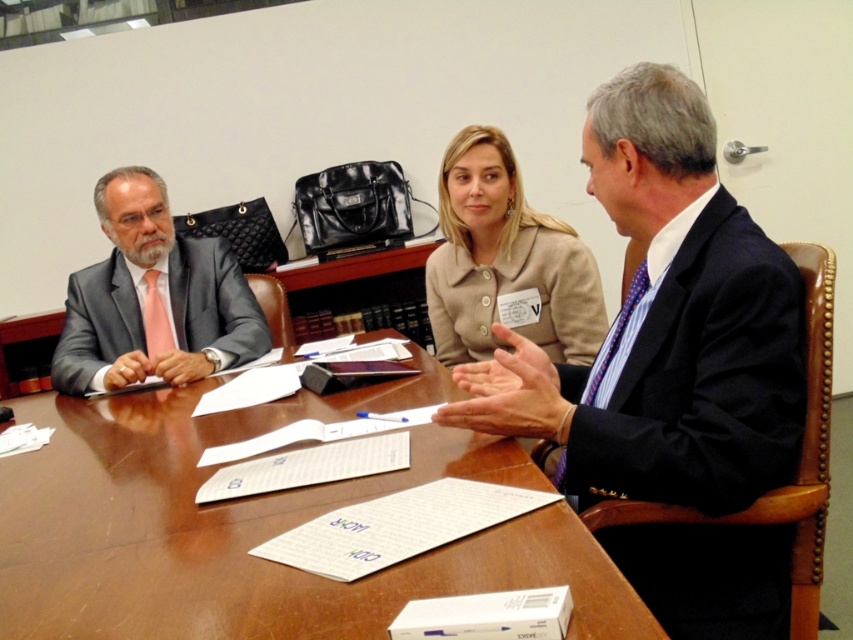
Does wooden table at center lie behind matte gray suit at left?

No.

Can you confirm if wooden table at center is smaller than matte gray suit at left?

Incorrect, wooden table at center is not smaller in size than matte gray suit at left.

Where is `wooden table at center`? wooden table at center is located at coordinates (256, 528).

Locate an element on the screen. The height and width of the screenshot is (640, 853). wooden table at center is located at coordinates (256, 528).

How much distance is there between navy blue suit at right and beige fabric jacket at center?

27.48 inches

Does navy blue suit at right have a larger size compared to beige fabric jacket at center?

Indeed, navy blue suit at right has a larger size compared to beige fabric jacket at center.

Where is `navy blue suit at right`? Image resolution: width=853 pixels, height=640 pixels. navy blue suit at right is located at coordinates (701, 378).

Between matte gray suit at left and beige fabric jacket at center, which one appears on the left side from the viewer's perspective?

From the viewer's perspective, matte gray suit at left appears more on the left side.

Can you confirm if matte gray suit at left is positioned below beige fabric jacket at center?

Yes.

Measure the distance between matte gray suit at left and camera.

matte gray suit at left is 5.93 feet away from camera.

The width and height of the screenshot is (853, 640). Identify the location of matte gray suit at left. (154, 298).